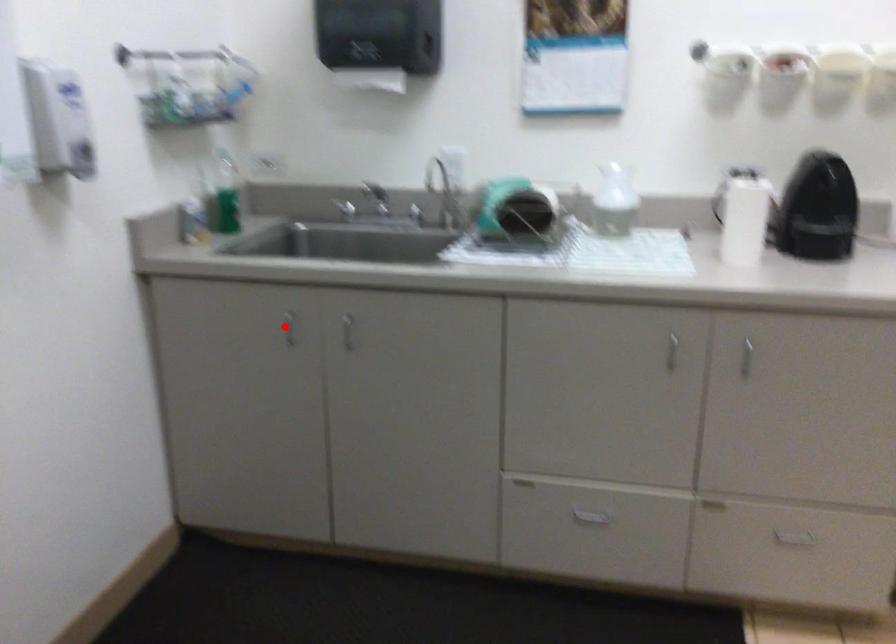
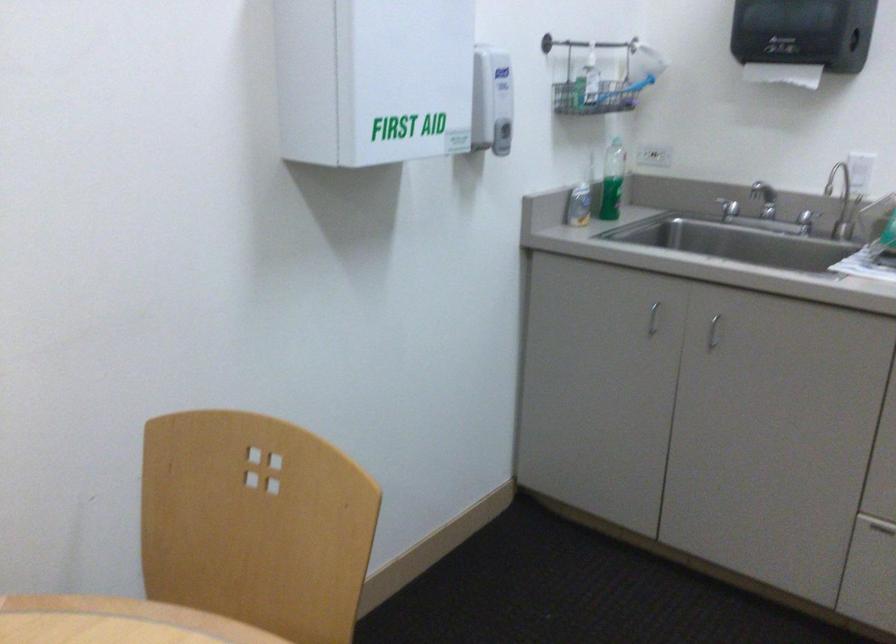
The point at the highlighted location is marked in the first image. Where is the corresponding point in the second image?

(652, 319)